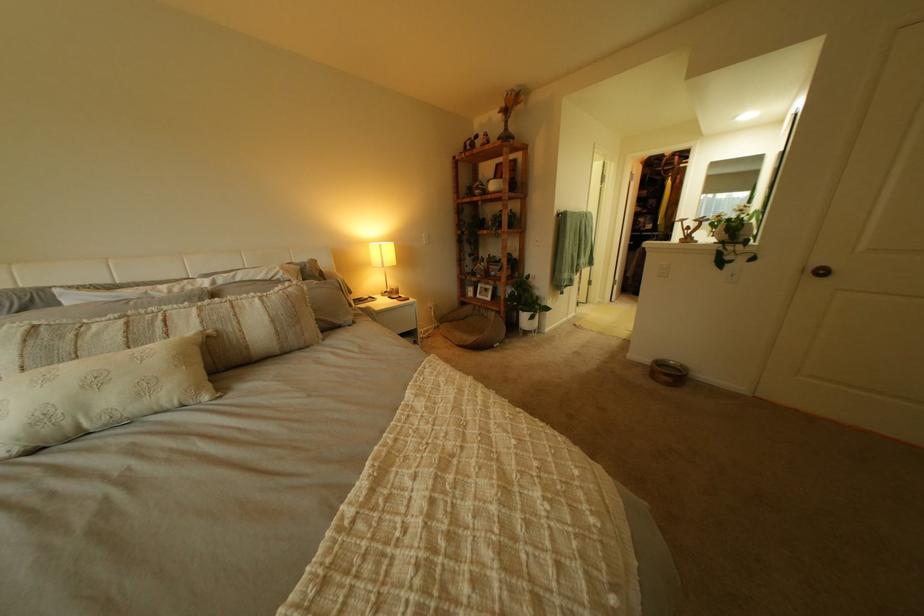
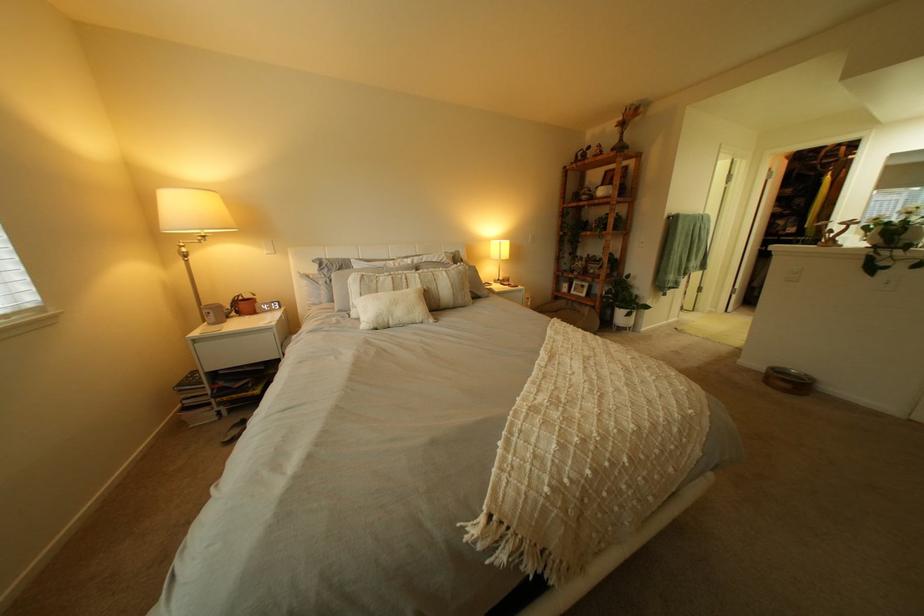
The point at (213,323) is marked in the first image. Where is the corresponding point in the second image?

(434, 283)